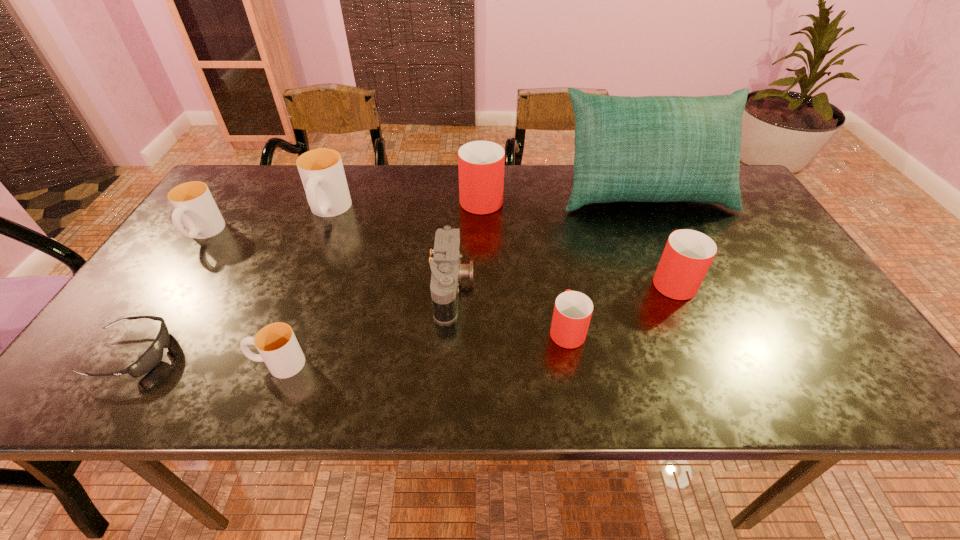
Locate an element on the screen. the seventh object from left to right is located at coordinates (572, 313).

Where is `the smallest yellow cup`? This screenshot has width=960, height=540. the smallest yellow cup is located at coordinates (278, 347).

I want to click on the nearest yellow cup, so click(x=278, y=347).

This screenshot has height=540, width=960. I want to click on the shortest object, so click(153, 355).

Where is `black goggles`? The height and width of the screenshot is (540, 960). black goggles is located at coordinates (153, 355).

What are the coordinates of `free location located 0.400m on the front-facing side of the cushion` in the screenshot? It's located at (708, 334).

The height and width of the screenshot is (540, 960). I want to click on vacant space located with the handle on the side of the biggest yellow cup, so click(x=296, y=293).

Locate an element on the screen. This screenshot has width=960, height=540. free space located 0.260m on the side of the fourth farthest cup with the handle is located at coordinates (637, 200).

Locate an element on the screen. vacant region located 0.290m on the side of the fourth farthest cup with the handle is located at coordinates (636, 194).

In order to click on free space located on the side of the fourth farthest cup with the handle in this screenshot , I will do `click(653, 234)`.